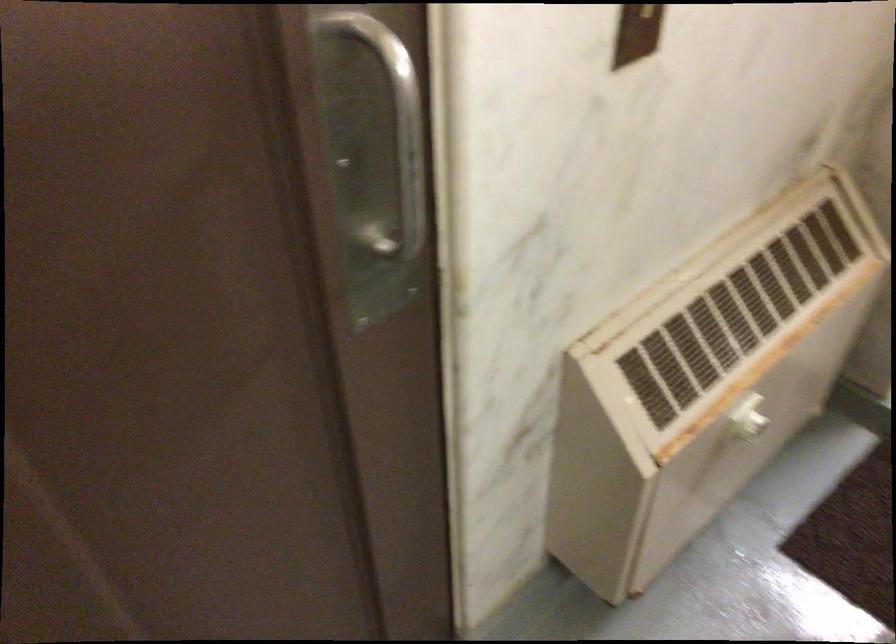
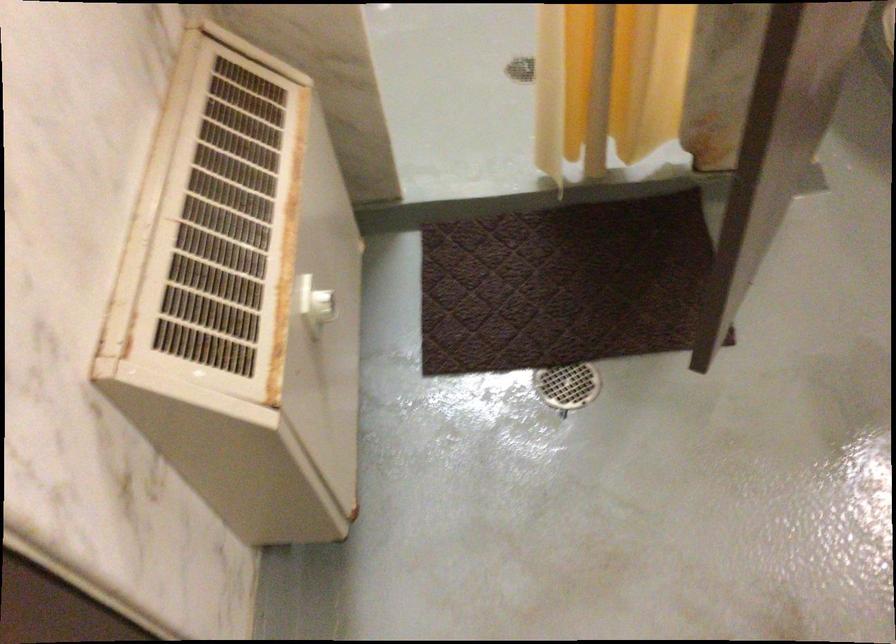
Find the pixel in the second image that matches point 746,420 in the first image.

(323, 306)